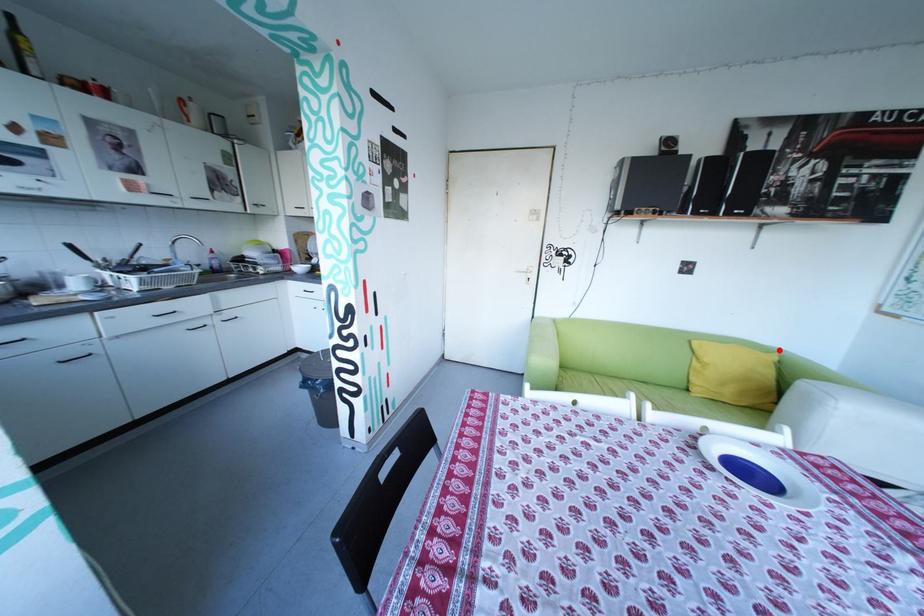
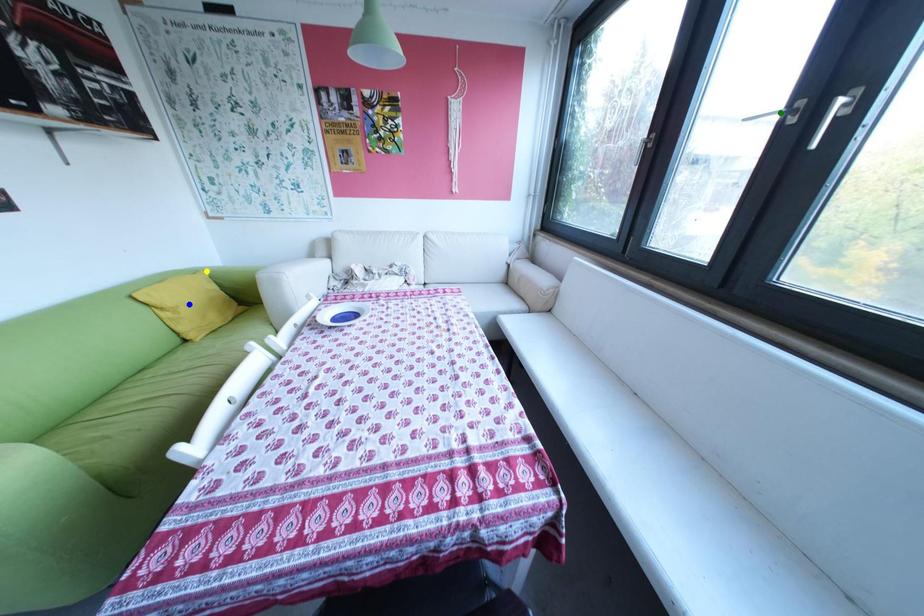
Question: I am providing you with two images of the same scene from different viewpoints. A red point is marked on the first image. You are given multiple points on the second image. In image 2, which mark is for the same physical point as the one in image 1?

Choices:
 (A) green point
 (B) yellow point
 (C) blue point

Answer: (B)